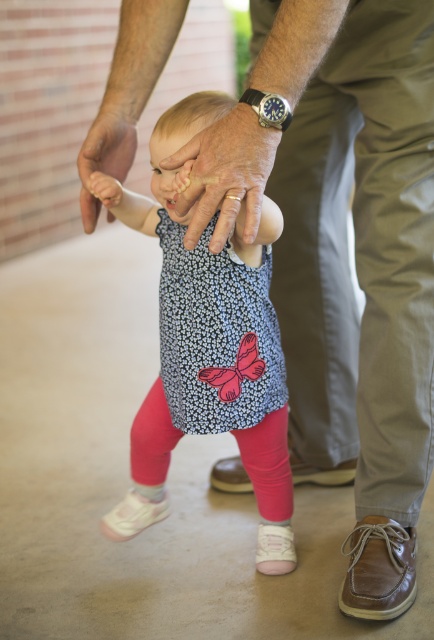
Is point (144, 209) closer to viewer compared to point (210, 480)?

Yes, point (144, 209) is closer to viewer.

Which is in front, point (253, 346) or point (295, 464)?

Point (253, 346) is in front.

The image size is (434, 640). I want to click on floral dress at center, so click(x=209, y=324).

Is matte skin hand at lower left closer to the viewer compared to white fabric shoe at lower center?

Yes, it is in front of white fabric shoe at lower center.

Is matte skin hand at lower left to the right of white fabric shoe at lower center from the viewer's perspective?

Incorrect, matte skin hand at lower left is not on the right side of white fabric shoe at lower center.

Is point (131, 104) more distant than point (268, 541)?

No, (131, 104) is closer to viewer.

Image resolution: width=434 pixels, height=640 pixels. I want to click on matte skin hand at lower left, so click(x=105, y=150).

Is matte skin hand at center smaller than white suede shoe at lower center?

No.

Who is more forward, (197,180) or (153,502)?

Point (197,180) is more forward.

Is point (210, 131) farther from viewer compared to point (148, 508)?

No, (210, 131) is in front of (148, 508).

Where is `matte skin hand at center`? The width and height of the screenshot is (434, 640). matte skin hand at center is located at coordinates (226, 173).